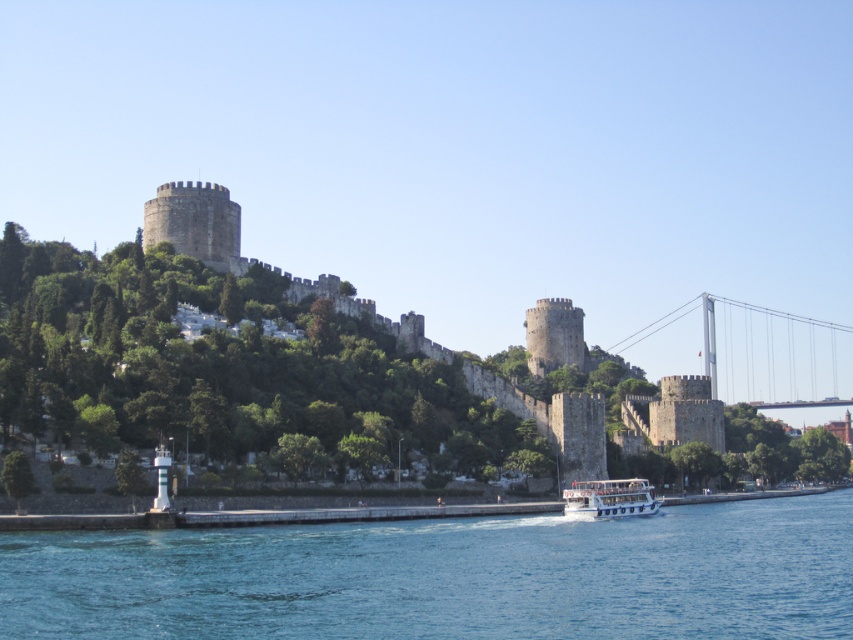
Question: Which object is the closest to the stone wall at center?

Choices:
 (A) white glossy boat at lower center
 (B) blue water at lower center
 (C) metallic gray bridge at right

Answer: (A)

Question: Does blue water at lower center appear over stone wall at center?

Choices:
 (A) yes
 (B) no

Answer: (B)

Question: Which point is closer to the camera?

Choices:
 (A) metallic gray bridge at right
 (B) stone wall at center
 (C) blue water at lower center
 (D) white glossy boat at lower center

Answer: (C)

Question: Is the position of stone wall at center more distant than that of metallic gray bridge at right?

Choices:
 (A) no
 (B) yes

Answer: (A)

Question: Which point is closer to the camera taking this photo?

Choices:
 (A) (486, 609)
 (B) (735, 337)
 (C) (463, 362)
 (D) (624, 516)

Answer: (A)

Question: Does stone wall at center appear over metallic gray bridge at right?

Choices:
 (A) no
 (B) yes

Answer: (B)